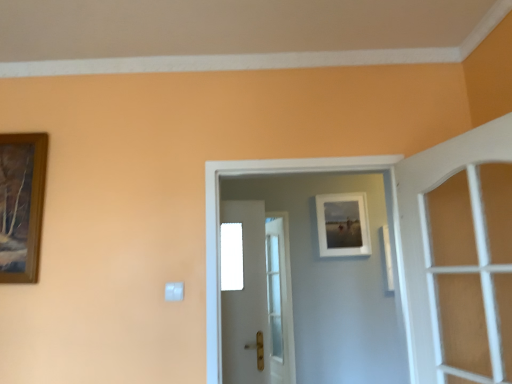
Question: Is white plastic light switch at lower left smaller than white glossy door at center, which appears as the second door when viewed from the front?

Choices:
 (A) yes
 (B) no

Answer: (A)

Question: Is white plastic light switch at lower left in front of white glossy door at center, the second door in the back-to-front sequence?

Choices:
 (A) yes
 (B) no

Answer: (B)

Question: From a real-world perspective, is white plastic light switch at lower left physically below white glossy door at center, which appears as the second door when viewed from the front?

Choices:
 (A) no
 (B) yes

Answer: (B)

Question: Is white plastic light switch at lower left beside white glossy door at center, the second door in the back-to-front sequence?

Choices:
 (A) yes
 (B) no

Answer: (B)

Question: Would you say white plastic light switch at lower left is a long distance from white glossy door at center, the second door in the back-to-front sequence?

Choices:
 (A) yes
 (B) no

Answer: (B)

Question: Considering the positions of matte white picture frame at upper center and white wooden door at right, the first door positioned from the front, in the image, is matte white picture frame at upper center wider or thinner than white wooden door at right, the first door positioned from the front,?

Choices:
 (A) wide
 (B) thin

Answer: (B)

Question: Considering the positions of matte white picture frame at upper center and white wooden door at right, the first door positioned from the front, in the image, is matte white picture frame at upper center bigger or smaller than white wooden door at right, the first door positioned from the front,?

Choices:
 (A) big
 (B) small

Answer: (B)

Question: From the image's perspective, is matte white picture frame at upper center positioned above or below white wooden door at right, which appears as the 3th door when viewed from the back?

Choices:
 (A) above
 (B) below

Answer: (B)

Question: Considering the positions of point (348, 236) and point (412, 233), is point (348, 236) closer or farther from the camera than point (412, 233)?

Choices:
 (A) farther
 (B) closer

Answer: (A)

Question: Is white glossy door at center, the 1th door in the back-to-front sequence, in front of or behind white plastic light switch at lower left in the image?

Choices:
 (A) front
 (B) behind

Answer: (B)

Question: From the image's perspective, is white glossy door at center, which is the 3th door from front to back, positioned above or below white plastic light switch at lower left?

Choices:
 (A) below
 (B) above

Answer: (A)

Question: Based on their positions, is white glossy door at center, the 1th door in the back-to-front sequence, located to the left or right of white plastic light switch at lower left?

Choices:
 (A) right
 (B) left

Answer: (A)

Question: From a real-world perspective, is white glossy door at center, which is the 3th door from front to back, positioned above or below white plastic light switch at lower left?

Choices:
 (A) above
 (B) below

Answer: (B)

Question: From the image's perspective, is white plastic light switch at lower left located above or below matte white picture frame at upper center?

Choices:
 (A) below
 (B) above

Answer: (A)

Question: Considering the positions of white plastic light switch at lower left and matte white picture frame at upper center in the image, is white plastic light switch at lower left bigger or smaller than matte white picture frame at upper center?

Choices:
 (A) small
 (B) big

Answer: (A)